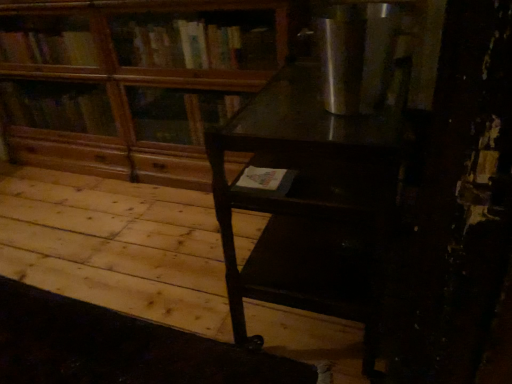
Locate an element on the screen. Image resolution: width=512 pixels, height=384 pixels. free spot in front of wooden bookcase at center is located at coordinates (119, 254).